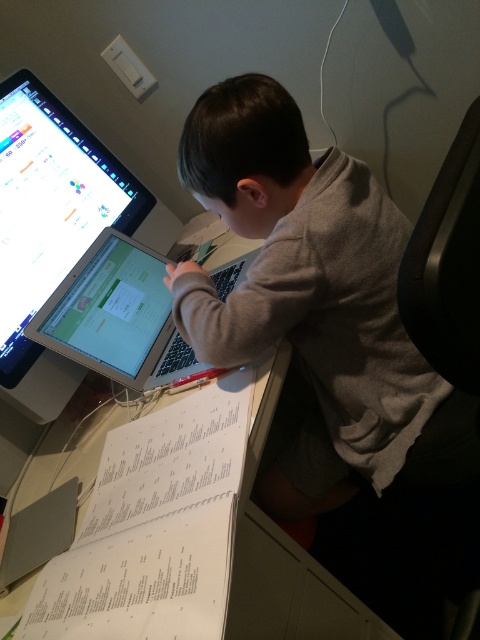
You are a student trying to reach the white paper at lower left and the silver metallic laptop at center on your desk. Which object is easier to grab without moving your chair?

The white paper at lower left is closer to the viewer than the silver metallic laptop at center, so it is easier to grab without moving your chair.

You are standing in front of the desk and want to reach the point at coordinates point [201,179]. If your arm can extend 35 inches, can you reach it without moving?

The point [201,179] is 34.72 inches from the viewer, so yes, your arm can reach it since it is within the 35 inches extension capability.

You are a photographer trying to capture a closeup of the gray matte shirt at upper center and the matte black monitor at upper left. Since you want to focus on both objects, which one should you adjust your camera to prioritize focusing on first?

The gray matte shirt at upper center is taller than the matte black monitor at upper left, so you should prioritize focusing on the gray matte shirt at upper center first because it is larger in the frame and requires more attention.